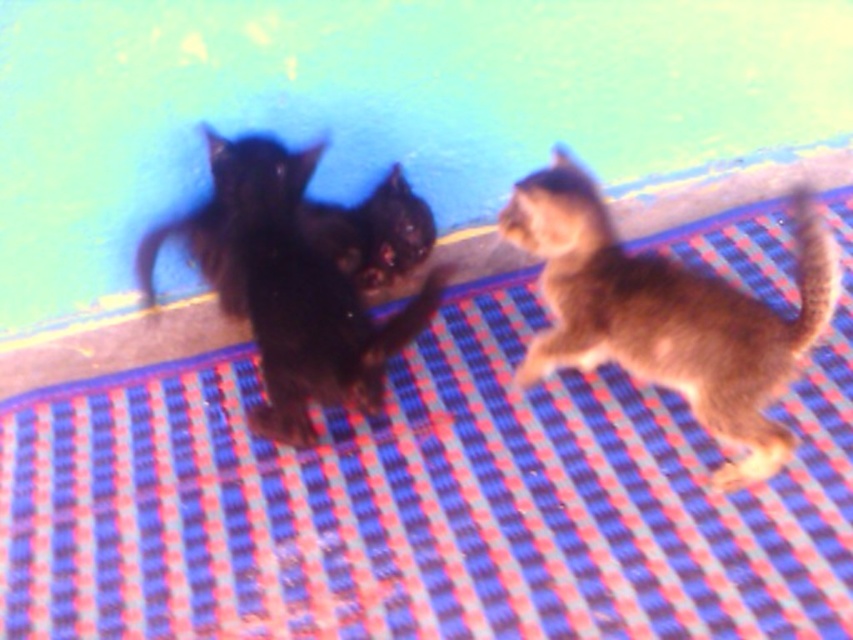
Consider the image. Does fuzzy brown cat at center have a greater height compared to shiny black kitten at center?

Correct, fuzzy brown cat at center is much taller as shiny black kitten at center.

Image resolution: width=853 pixels, height=640 pixels. Describe the element at coordinates (666, 312) in the screenshot. I see `fuzzy brown cat at center` at that location.

Identify the location of fuzzy brown cat at center. The width and height of the screenshot is (853, 640). (666, 312).

The image size is (853, 640). In order to click on fuzzy brown cat at center in this screenshot , I will do click(666, 312).

This screenshot has height=640, width=853. Find the location of `blue checkered mat at center`. blue checkered mat at center is located at coordinates (424, 500).

Does point (505, 616) come farther from viewer compared to point (770, 465)?

No, (505, 616) is in front of (770, 465).

Between point (508, 468) and point (833, 269), which one is positioned in front?

Positioned in front is point (833, 269).

The height and width of the screenshot is (640, 853). Identify the location of blue checkered mat at center. (424, 500).

Measure the distance from blue checkered mat at center to shiny black kitten at center.

blue checkered mat at center and shiny black kitten at center are 24.61 centimeters apart.

Is blue checkered mat at center to the left of shiny black kitten at center from the viewer's perspective?

Incorrect, blue checkered mat at center is not on the left side of shiny black kitten at center.

Describe the element at coordinates (424, 500) in the screenshot. I see `blue checkered mat at center` at that location.

I want to click on blue checkered mat at center, so click(x=424, y=500).